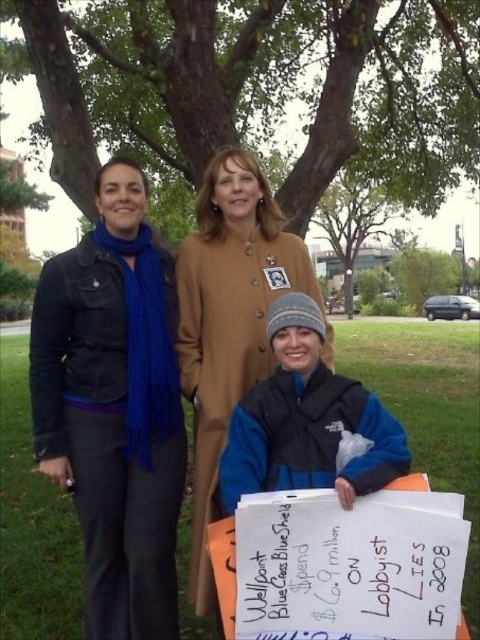
You are taking a photo of the scene and want to ensure the blue matte scarf at left is centered in the frame. Based on its current position at coordinates point 0.637, 0.237, what adjustment should you make to the camera to center it?

To center the blue matte scarf at left, adjust the camera so that its coordinates align with the center point of the frame, which is typically at (240, 320). Since the scarf is currently at 0.637 on the x and 0.237 on the y, move the camera slightly to the left and down to bring it to the center.

You are standing in a park and see the blue matte scarf at left and the matte brown coat at center. Which object is closer to you?

The blue matte scarf at left is closer to you because it is further to the viewer than the matte brown coat at center.

You are standing in the park and want to take a photo of the point at coordinates (133, 484). The camera you are using has a focal length of 50mm and a sensor size of 24mm. If the camera is focused at infinity, what is the minimum distance you need to move forward so that the point fills the entire width of the photo?

The point at coordinates (133, 484) is 2.59 meters away from the camera. To fill the width of the photo, the distance should be approximately 0.24 meters. Therefore, you need to move forward by 2.35 meters.